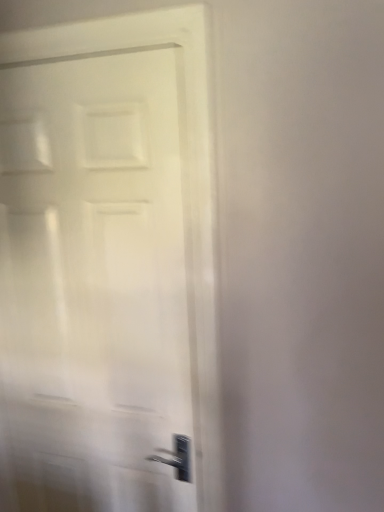
What do you see at coordinates (94, 282) in the screenshot? I see `white glossy door at left` at bounding box center [94, 282].

In order to face white glossy door at left, should I rotate leftwards or rightwards?

Rotate left and turn 14.675 degrees.

Identify the location of white glossy door at left. (94, 282).

What are the coordinates of `white glossy door at left` in the screenshot? It's located at (94, 282).